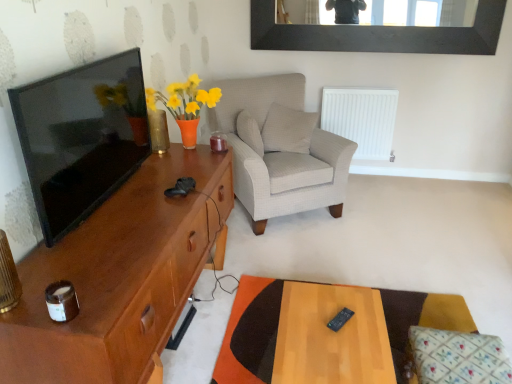
Image resolution: width=512 pixels, height=384 pixels. Find the location of `vacant space situated on the left part of wooden rectangular table at center`. vacant space situated on the left part of wooden rectangular table at center is located at coordinates (227, 342).